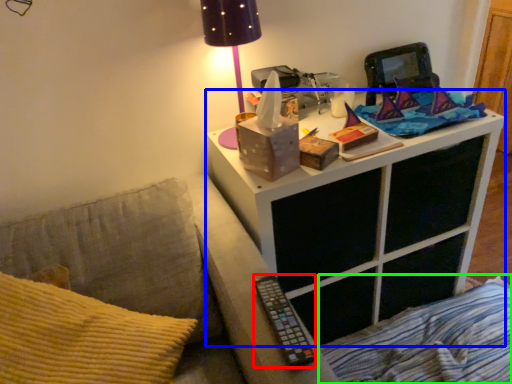
Question: Which is farther away from remote (highlighted by a red box)? nightstand (highlighted by a blue box) or bedding (highlighted by a green box)?

Choices:
 (A) nightstand
 (B) bedding

Answer: (B)